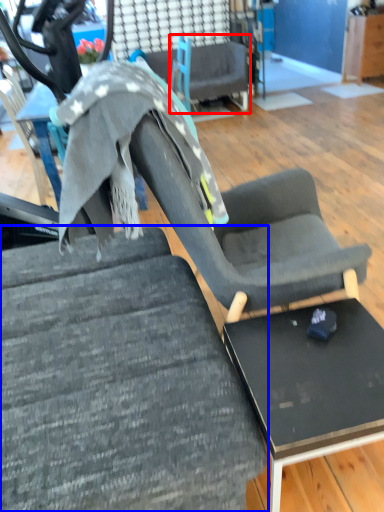
Question: Among these objects, which one is nearest to the camera, chair (highlighted by a red box) or chair (highlighted by a blue box)?

Choices:
 (A) chair
 (B) chair

Answer: (B)